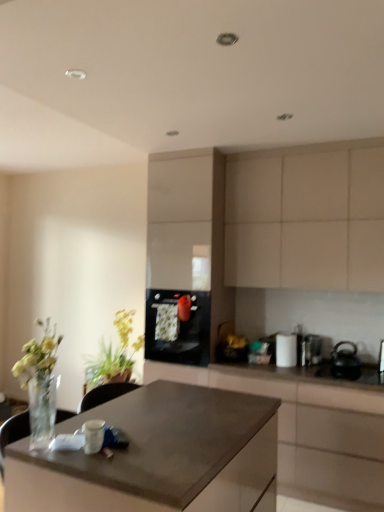
Question: In terms of width, does black glossy oven at center look wider or thinner when compared to white glossy canister at upper right, which is counted as the third appliance, starting from the right?

Choices:
 (A) wide
 (B) thin

Answer: (A)

Question: Relative to white glossy canister at upper right, which is counted as the third appliance, starting from the right, is black glossy oven at center in front or behind?

Choices:
 (A) behind
 (B) front

Answer: (A)

Question: Which object is the closest to the black matte kettle at right, the 3th appliance viewed from the left?

Choices:
 (A) matte black countertop at center, the first cabinetry in the bottom-to-top sequence
 (B) green leafy plant at left
 (C) beige matte cabinet at upper right, the 2th cabinetry in the bottom-to-top sequence
 (D) satin silver toaster at right, which is the second appliance in right-to-left order
 (E) matte brown desk at center

Answer: (D)

Question: Estimate the real-world distances between objects in this image. Which object is farther from the green leafy plant at left?

Choices:
 (A) black glossy oven at center
 (B) satin silver toaster at right, the second appliance positioned from the left
 (C) white glossy canister at upper right, which is counted as the third appliance, starting from the right
 (D) matte brown desk at center
 (E) matte black countertop at center, the 2th cabinetry when ordered from top to bottom

Answer: (D)